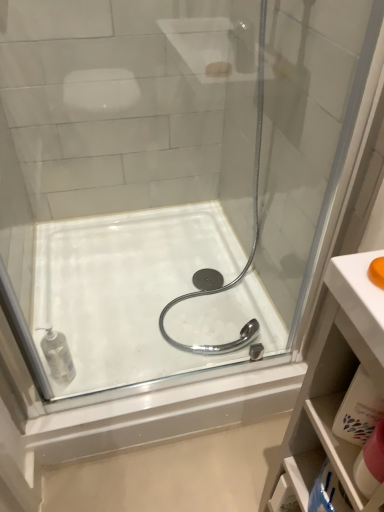
Question: From the image's perspective, does white glossy bath at center appear higher than clear plastic soap dispenser at lower left, marked as the first toiletry in a back-to-front arrangement?

Choices:
 (A) yes
 (B) no

Answer: (A)

Question: Is white glossy bath at center not close to clear plastic soap dispenser at lower left, positioned as the 1th toiletry in left-to-right order?

Choices:
 (A) no
 (B) yes

Answer: (A)

Question: Is white glossy bath at center in front of clear plastic soap dispenser at lower left, positioned as the 1th toiletry in left-to-right order?

Choices:
 (A) yes
 (B) no

Answer: (B)

Question: Is white glossy bath at center outside of clear plastic soap dispenser at lower left, marked as the first toiletry in a back-to-front arrangement?

Choices:
 (A) yes
 (B) no

Answer: (A)

Question: Is white glossy bath at center oriented towards clear plastic soap dispenser at lower left, positioned as the 1th toiletry in left-to-right order?

Choices:
 (A) yes
 (B) no

Answer: (B)

Question: Can you confirm if white glossy bath at center is bigger than clear plastic soap dispenser at lower left, the 2th toiletry positioned from the right?

Choices:
 (A) yes
 (B) no

Answer: (A)

Question: Is the depth of clear plastic soap dispenser at lower left, the 2th toiletry positioned from the right, greater than that of pink fabric towel at lower right, placed as the second toiletry when sorted from left to right?

Choices:
 (A) no
 (B) yes

Answer: (B)

Question: From the image's perspective, is clear plastic soap dispenser at lower left, the 2th toiletry positioned from the right, on pink fabric towel at lower right, placed as the 1th toiletry when sorted from right to left?

Choices:
 (A) yes
 (B) no

Answer: (A)

Question: From a real-world perspective, is clear plastic soap dispenser at lower left, positioned as the 1th toiletry in left-to-right order, positioned over pink fabric towel at lower right, placed as the second toiletry when sorted from left to right, based on gravity?

Choices:
 (A) no
 (B) yes

Answer: (A)

Question: From the image's perspective, is clear plastic soap dispenser at lower left, marked as the first toiletry in a back-to-front arrangement, located beneath pink fabric towel at lower right, placed as the 1th toiletry when sorted from right to left?

Choices:
 (A) no
 (B) yes

Answer: (A)

Question: Considering the relative positions of clear plastic soap dispenser at lower left, marked as the first toiletry in a back-to-front arrangement, and pink fabric towel at lower right, placed as the 1th toiletry when sorted from right to left, in the image provided, is clear plastic soap dispenser at lower left, marked as the first toiletry in a back-to-front arrangement, to the left of pink fabric towel at lower right, placed as the 1th toiletry when sorted from right to left, from the viewer's perspective?

Choices:
 (A) yes
 (B) no

Answer: (A)

Question: Could you tell me if clear plastic soap dispenser at lower left, the 2th toiletry positioned from the right, is turned towards pink fabric towel at lower right, placed as the second toiletry when sorted from left to right?

Choices:
 (A) yes
 (B) no

Answer: (B)

Question: Are pink fabric towel at lower right, placed as the 1th toiletry when sorted from right to left, and clear plastic soap dispenser at lower left, marked as the first toiletry in a back-to-front arrangement, beside each other?

Choices:
 (A) yes
 (B) no

Answer: (B)